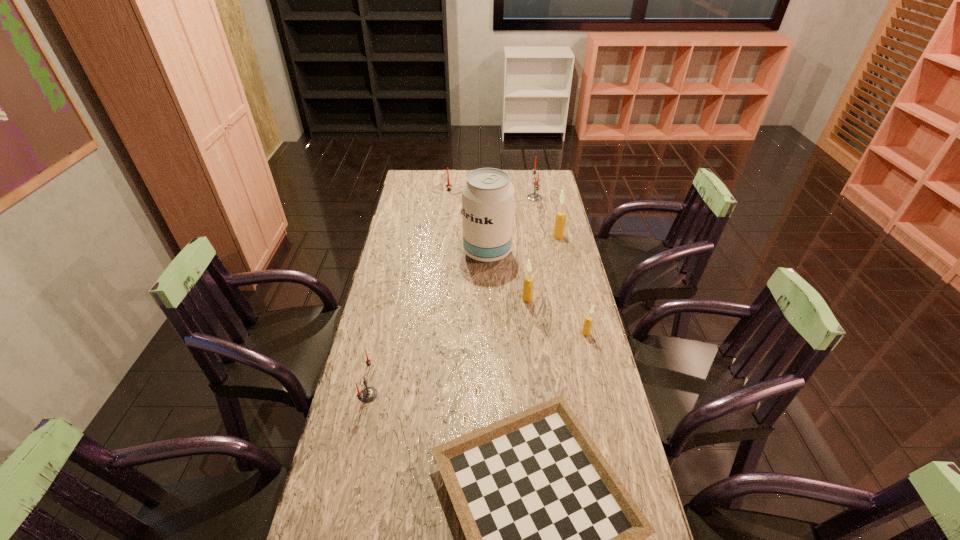
You are a GUI agent. You are given a task and a screenshot of the screen. Output one action in this format:
    pyautogui.click(x=<x>, y=<y>)
    Task: Click on the red candle that stands as the third closest to the third nearest object
    The width and height of the screenshot is (960, 540).
    Given the screenshot: What is the action you would take?
    pyautogui.click(x=534, y=196)

Select which red candle is the second closest to the shortest object. Please provide its 2D coordinates. Your answer should be formatted as a tuple, i.e. [(x, y)], where the tuple contains the x and y coordinates of a point satisfying the conditions above.

[(448, 185)]

I want to click on cream candle that stands as the second closest to the shortest object, so click(x=528, y=282).

I want to click on cream candle that is the third closest one to the rightmost red candle, so click(x=588, y=321).

Identify the location of free space in the image that satisfies the following two spatial constraints: 1. on the front side of the leftmost cream candle; 2. on the right side of the tallest object. The image size is (960, 540). (489, 299).

This screenshot has width=960, height=540. Find the location of `vacant point that satisfies the following two spatial constraints: 1. on the front-facing side of the alcohol; 2. on the left side of the second candle from left to right`. vacant point that satisfies the following two spatial constraints: 1. on the front-facing side of the alcohol; 2. on the left side of the second candle from left to right is located at coordinates point(469,252).